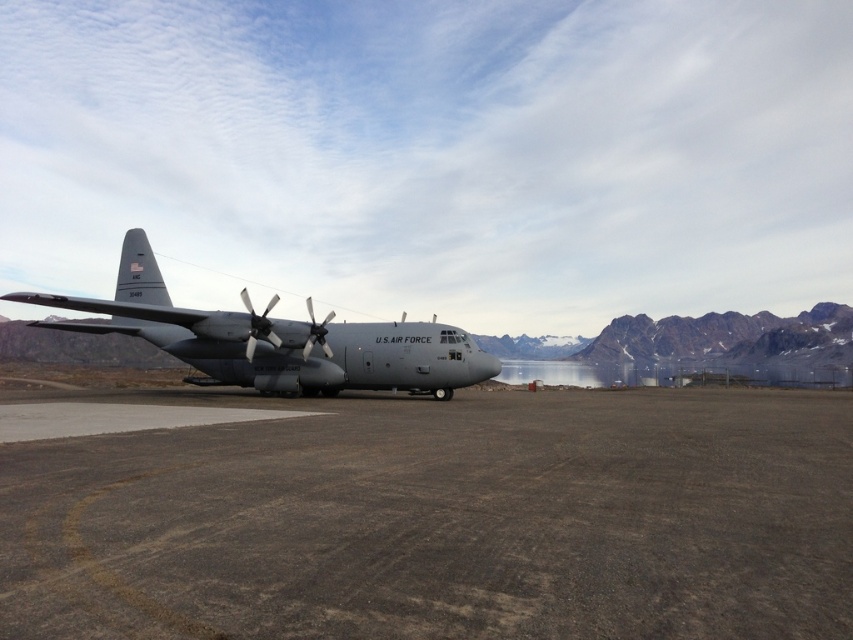
Question: Is brown gravel at center bigger than gray matte airplane at center?

Choices:
 (A) no
 (B) yes

Answer: (A)

Question: Can you confirm if brown gravel at center is bigger than gray matte airplane at center?

Choices:
 (A) yes
 (B) no

Answer: (B)

Question: Which of the following is the closest to the observer?

Choices:
 (A) brown gravel at center
 (B) gray matte airplane at center

Answer: (A)

Question: Observing the image, what is the correct spatial positioning of brown gravel at center in reference to gray matte airplane at center?

Choices:
 (A) left
 (B) right

Answer: (B)

Question: Among these objects, which one is farthest from the camera?

Choices:
 (A) gray matte airplane at center
 (B) brown gravel at center

Answer: (A)